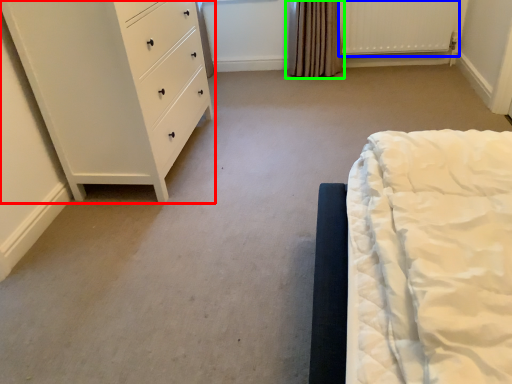
Question: Which is nearer to the chest of drawers (highlighted by a red box)? radiator (highlighted by a blue box) or curtain (highlighted by a green box).

Choices:
 (A) radiator
 (B) curtain

Answer: (B)